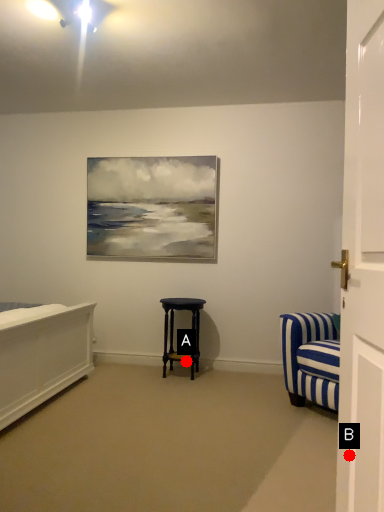
Question: Two points are circled on the image, labeled by A and B beside each circle. Which point is farther to the camera?

Choices:
 (A) A is further
 (B) B is further

Answer: (A)